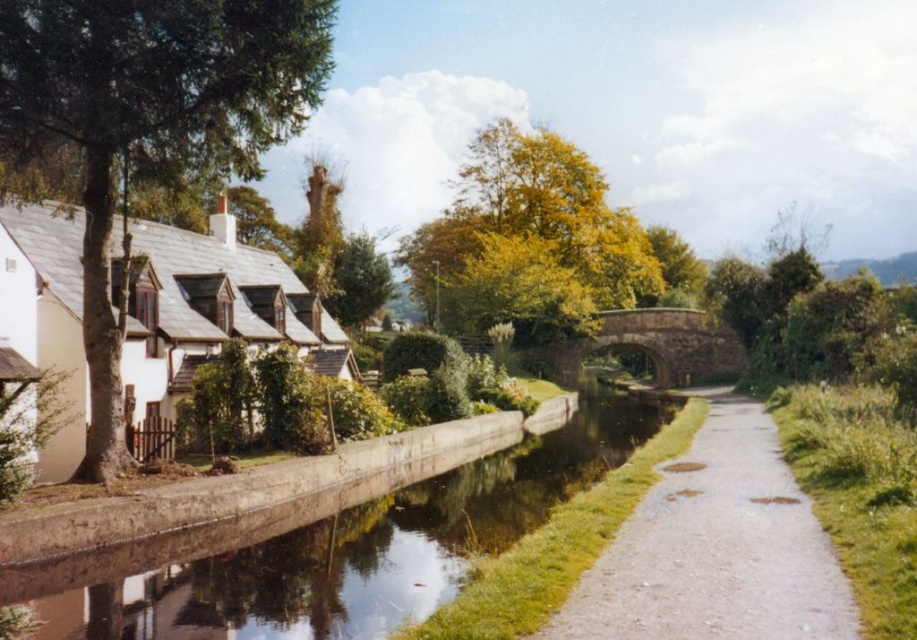
Question: In this image, where is smooth concrete canal at center located relative to white matte cottage at left?

Choices:
 (A) right
 (B) left

Answer: (A)

Question: Which point is farther to the camera?

Choices:
 (A) (758, 561)
 (B) (174, 625)

Answer: (B)

Question: Which point is farther to the camera?

Choices:
 (A) (558, 348)
 (B) (8, 259)
 (C) (340, 506)

Answer: (A)

Question: Estimate the real-world distances between objects in this image. Which object is closer to the stone arch bridge at center?

Choices:
 (A) smooth concrete canal at center
 (B) white matte cottage at left

Answer: (B)

Question: Does white matte cottage at left have a larger size compared to stone arch bridge at center?

Choices:
 (A) yes
 (B) no

Answer: (B)

Question: Does smooth concrete canal at center lie in front of stone arch bridge at center?

Choices:
 (A) yes
 (B) no

Answer: (A)